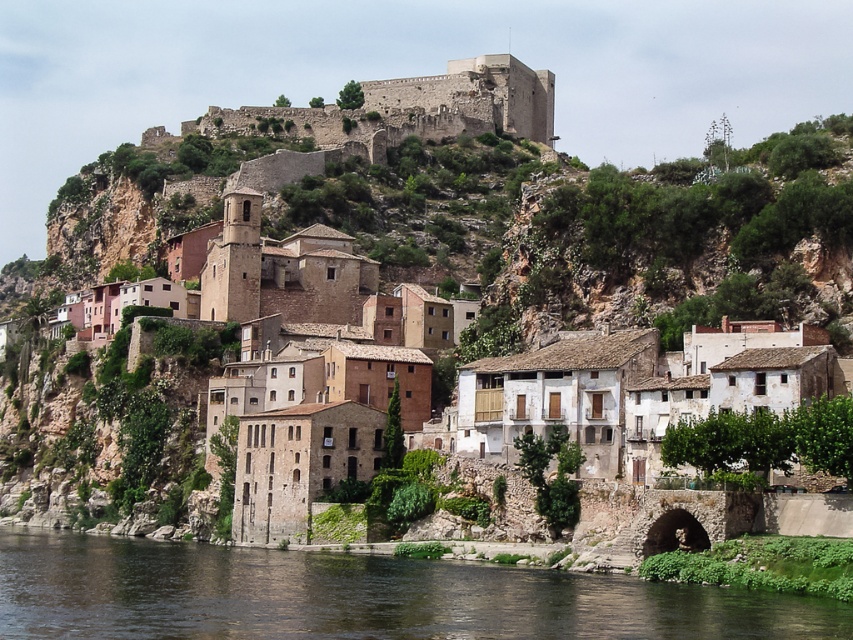
You are standing at the riverbank and want to take a photo of both the beige stone houses at center and the rustic stone castle at upper center. Which one should you focus on first to ensure both are in sharp focus?

You should focus on the beige stone houses at center first since it is closer to you than the rustic stone castle at upper center. By focusing on the closer object, the castle in the background will also be in focus due to the depth of field.

You are a tourist standing on the riverbank and want to take a photo of both the beige stone houses at center and the rustic stone castle at upper center. Which of the two structures should you frame wider in your camera to capture their full width?

You should frame the beige stone houses at center wider because their width surpasses that of the rustic stone castle at upper center.

You are standing at the riverbank in the picturesque town and want to take a photo of the castle. You notice two points marked on your map at coordinates point (274, 403) and point (505, 108). According to the map, which point is closer to you as you stand at the riverbank?

Point (274, 403) is in front of point (505, 108), so it is closer to you as you stand at the riverbank.